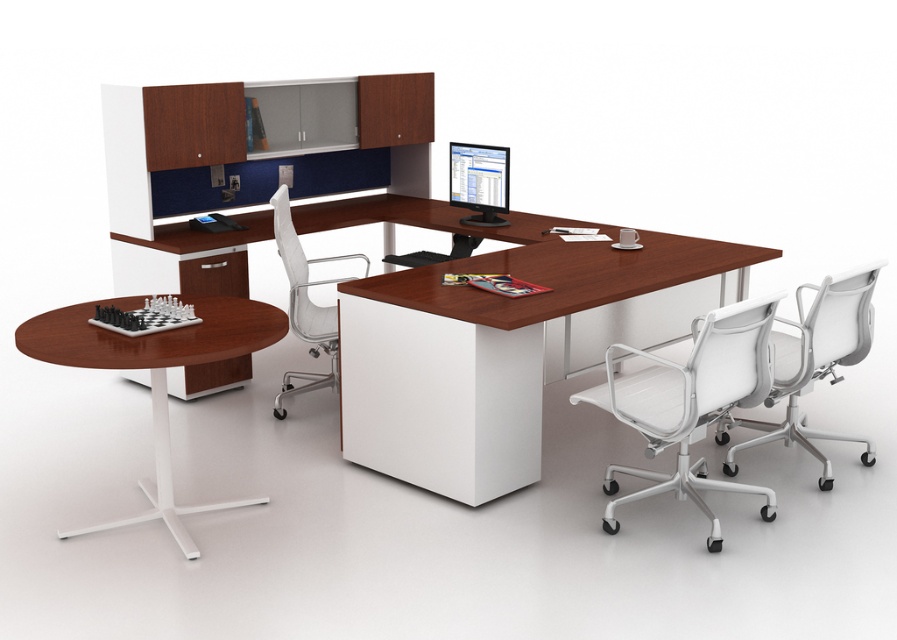
What do you see at coordinates (690, 403) in the screenshot?
I see `white mesh swivel chair at lower right` at bounding box center [690, 403].

How much distance is there between white mesh swivel chair at lower right and mahogany wood table at left?

6.66 feet

Is point (677, 467) more distant than point (98, 301)?

No, it is not.

Find the location of a particular element. white mesh swivel chair at lower right is located at coordinates (690, 403).

The width and height of the screenshot is (897, 640). What do you see at coordinates (155, 376) in the screenshot? I see `mahogany wood table at left` at bounding box center [155, 376].

Consider the image. How distant is mahogany wood table at left from white plastic swivel chair at right?

mahogany wood table at left and white plastic swivel chair at right are 9.47 feet apart.

Is point (192, 545) more distant than point (785, 381)?

No.

This screenshot has height=640, width=897. What are the coordinates of `mahogany wood table at left` in the screenshot? It's located at (155, 376).

Who is taller, white mesh swivel chair at lower right or white plastic swivel chair at right?

white plastic swivel chair at right

Between point (677, 468) and point (784, 349), which one is positioned in front?

Point (677, 468) is in front.

Find the location of a particular element. This screenshot has height=640, width=897. white mesh swivel chair at lower right is located at coordinates (690, 403).